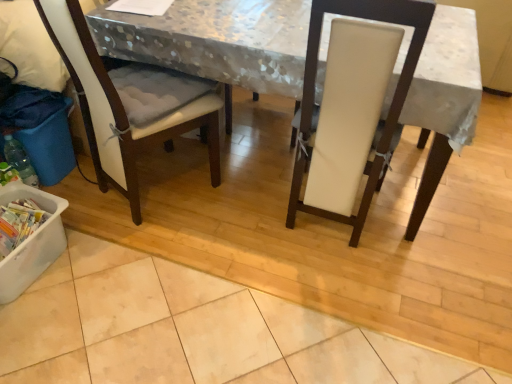
Where is `free space that is in between white leather chair at center, which is the 1th chair from right to left, and white plastic container at lower left, placed as the 2th recycling bin when sorted from top to bottom`? The height and width of the screenshot is (384, 512). free space that is in between white leather chair at center, which is the 1th chair from right to left, and white plastic container at lower left, placed as the 2th recycling bin when sorted from top to bottom is located at coordinates (185, 245).